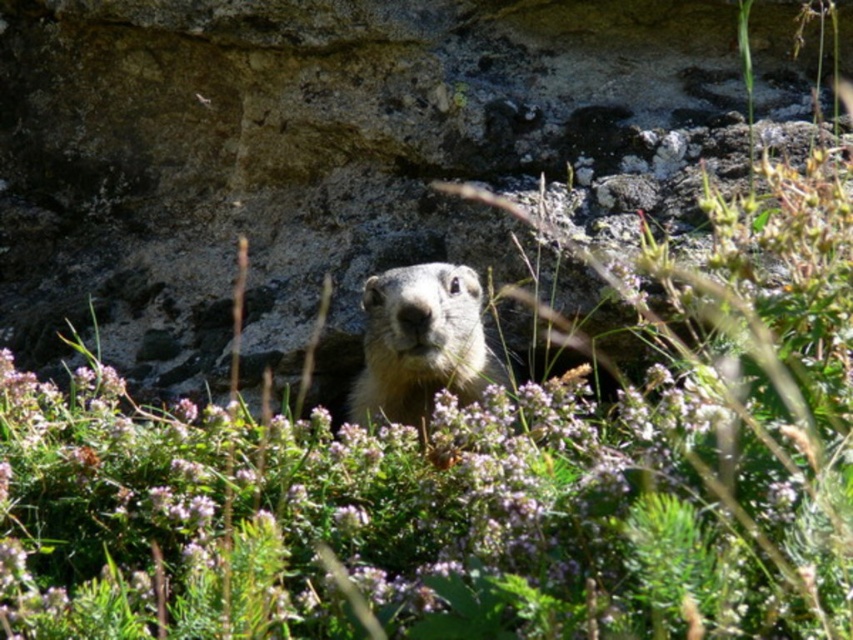
Measure the distance from gray rock at center to furry brown ground squirrel at center.

gray rock at center is 12.63 inches away from furry brown ground squirrel at center.

Which is behind, point (520, 67) or point (358, 417)?

Point (520, 67)

Is point (310, 150) closer to viewer compared to point (407, 292)?

That is False.

Where is `gray rock at center`? This screenshot has height=640, width=853. gray rock at center is located at coordinates (361, 156).